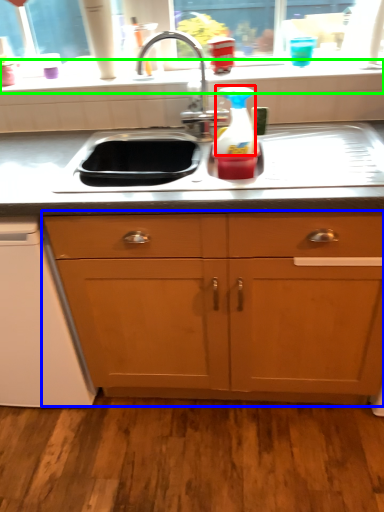
Question: Which is farther away from appliance (highlighted by a red box)? cabinetry (highlighted by a blue box) or window sill (highlighted by a green box)?

Choices:
 (A) cabinetry
 (B) window sill

Answer: (A)